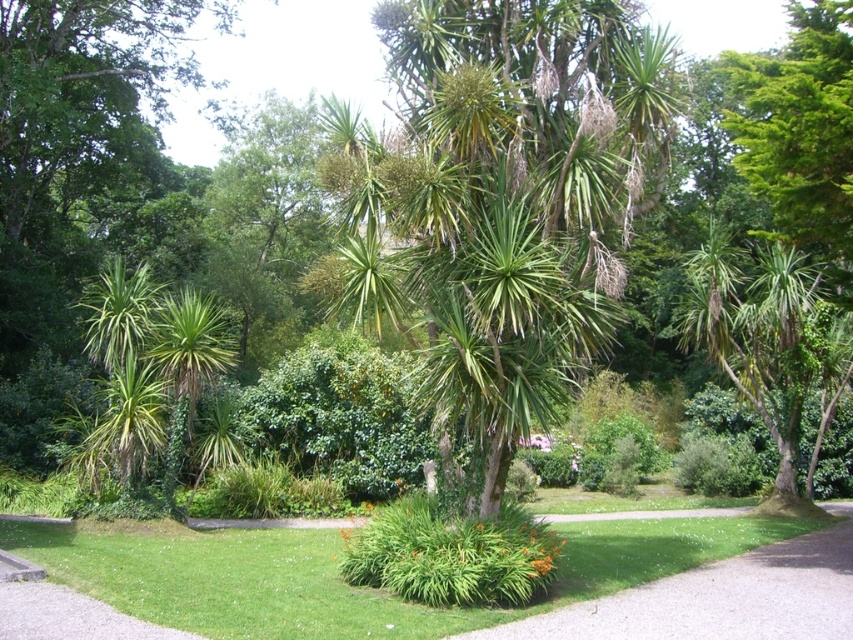
Question: Can you confirm if green leafy grass at lower center is positioned below green grass at lower center?

Choices:
 (A) no
 (B) yes

Answer: (A)

Question: Which object appears farthest from the camera in this image?

Choices:
 (A) green leafy palm tree at center
 (B) green grass at lower center
 (C) green leafy grass at lower center
 (D) green leafy bush at center

Answer: (D)

Question: Is green leafy palm tree at center above green leafy bush at center?

Choices:
 (A) yes
 (B) no

Answer: (A)

Question: Which of the following is the farthest from the observer?

Choices:
 (A) (589, 618)
 (B) (540, 81)
 (C) (695, 627)
 (D) (415, 456)

Answer: (D)

Question: Is green leafy grass at lower center further to the viewer compared to green grass at lower center?

Choices:
 (A) no
 (B) yes

Answer: (A)

Question: Which of these objects is positioned closest to the green leafy grass at lower center?

Choices:
 (A) green leafy bush at center
 (B) green grass at lower center
 (C) green leafy palm tree at center

Answer: (B)